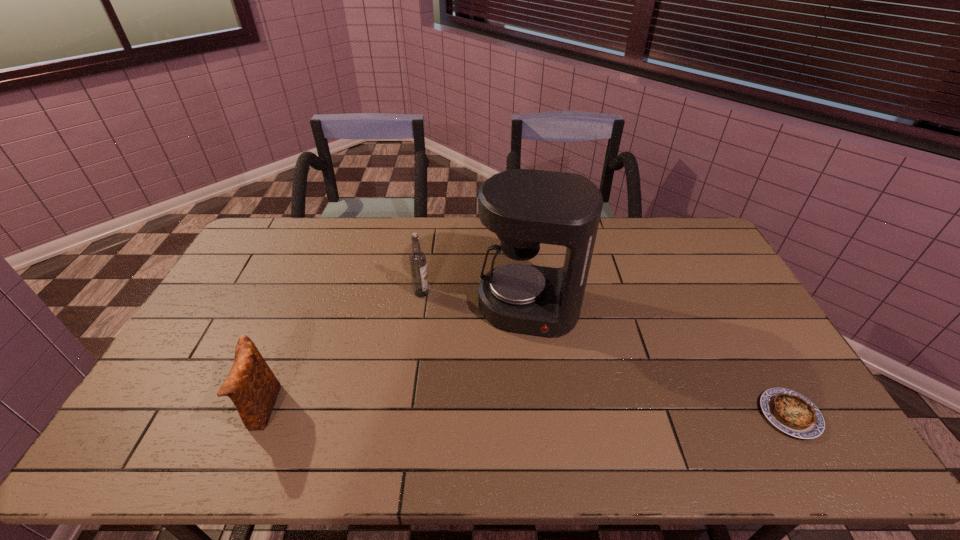
The image size is (960, 540). In order to click on vacant space on the desktop that is between the third tallest object and the quiche and is positioned on the label of the second object from left to right in this screenshot , I will do `click(526, 411)`.

I want to click on vacant space on the desktop that is between the clutch bag and the rightmost object and is positioned on the button side of the tallest object, so click(x=514, y=411).